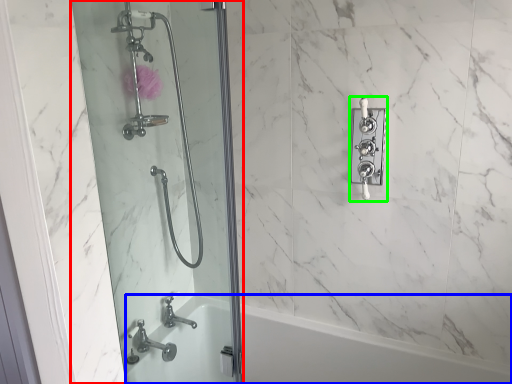
Question: Which object is the farthest from screen door (highlighted by a red box)? Choose among these: bath (highlighted by a blue box) or lock (highlighted by a green box).

Choices:
 (A) bath
 (B) lock

Answer: (B)